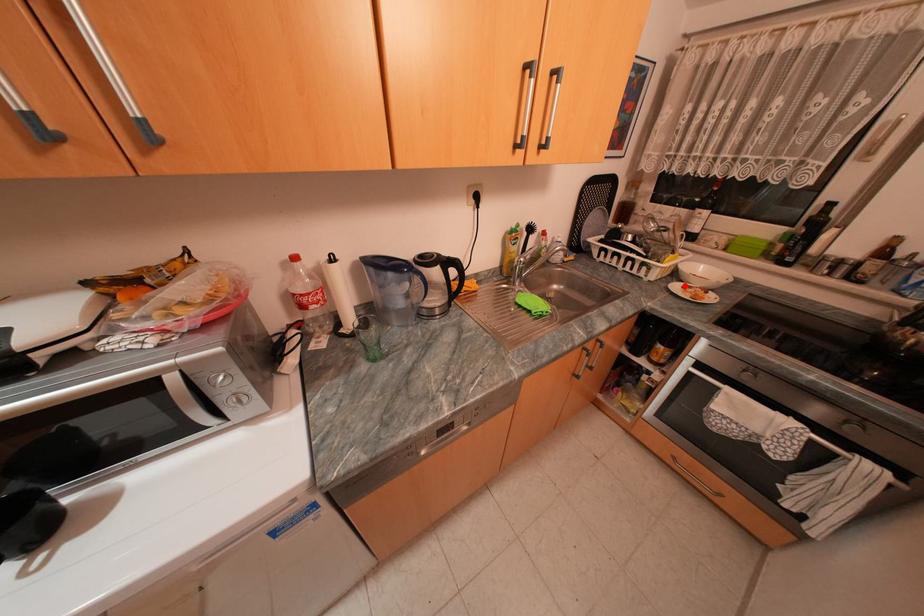
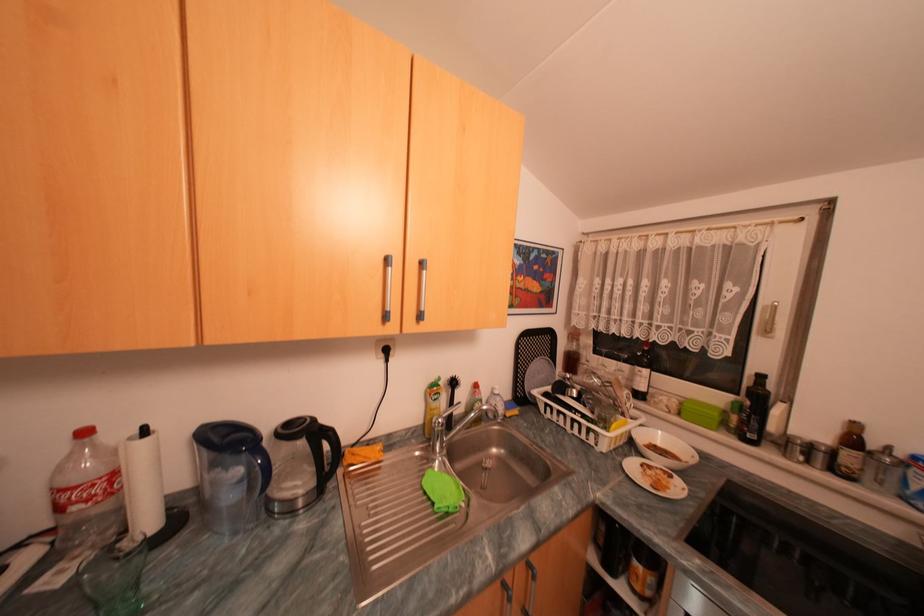
The point at the highlighted location is marked in the first image. Where is the corresponding point in the second image?

(641, 464)